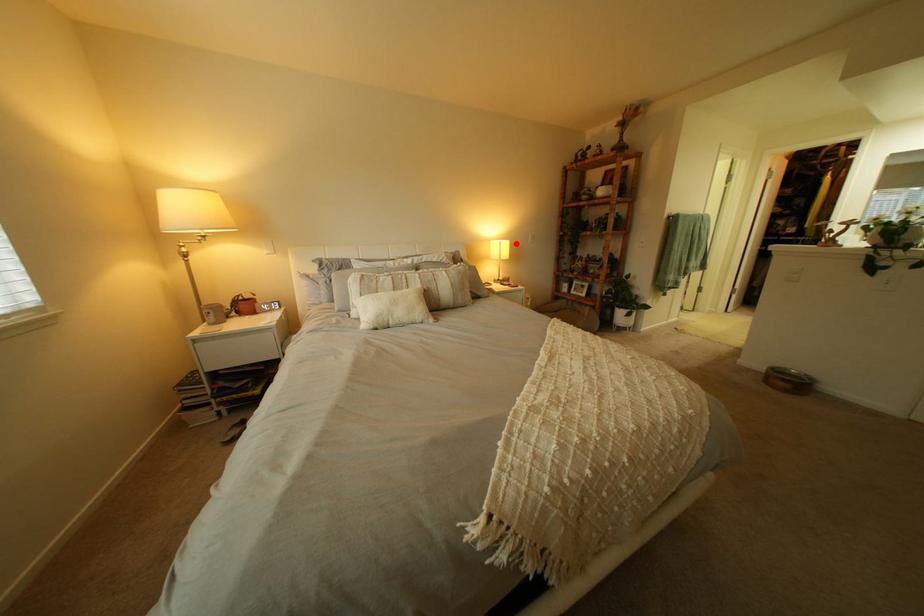
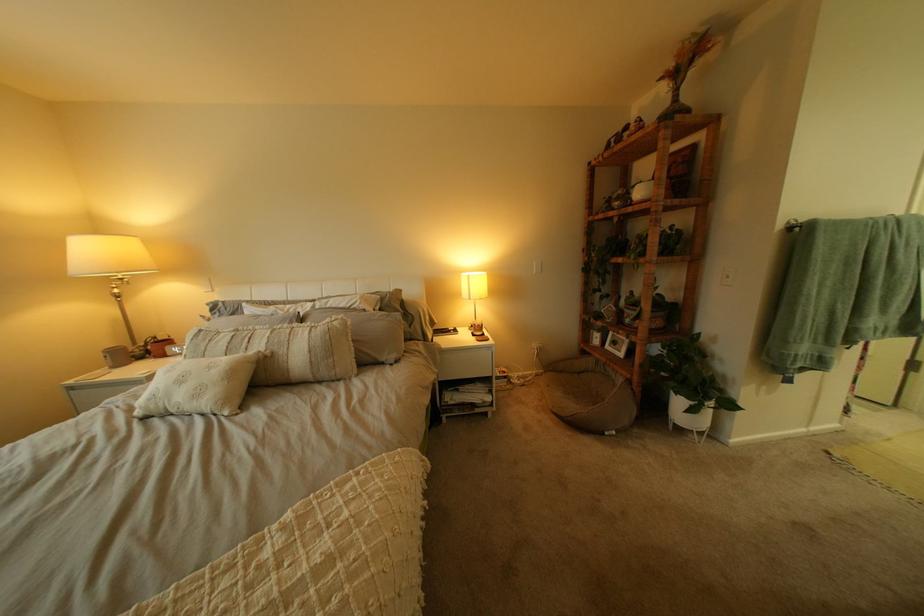
The point at the highlighted location is marked in the first image. Where is the corresponding point in the second image?

(483, 277)